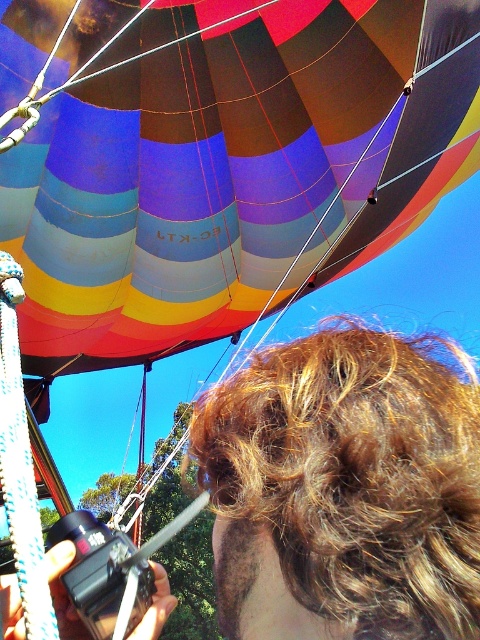
You are a photographer trying to capture the multicolored fabric balloon at upper center and the shiny brown hair at center in a single shot. Based on their positions, will the balloon appear closer or farther in the photo compared to the person?

The multicolored fabric balloon at upper center is further to the viewer than shiny brown hair at center, so in the photo, the balloon will appear closer to the camera than the person.

You are a photographer trying to capture the multicolored fabric balloon at upper center and the shiny brown hair at center in the same frame. Based on their positions, can you determine which subject is closer to the camera?

The multicolored fabric balloon at upper center is located above shiny brown hair at center, meaning it is farther away from the camera. Therefore, the shiny brown hair at center is closer to the camera.

You are a photographer trying to capture the multicolored fabric balloon at upper center and the shiny brown hair at center in the same frame. Based on their positions, which object should you adjust your camera to focus on first to ensure both are in the frame?

The multicolored fabric balloon at upper center is to the left of shiny brown hair at center. To ensure both are in the frame, focus on the multicolored fabric balloon at upper center first since it is positioned further left, allowing you to adjust the camera to include both objects from left to right.